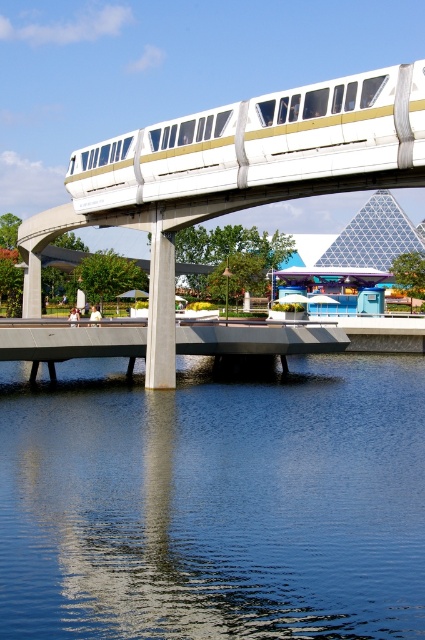
From the picture: You are standing on the futuristic monorail train traveling over the water and looking down. There is a point marked at coordinates (x=214, y=502). What would you see at that point?

The point at coordinates (x=214, y=502) indicates blue smooth water at center.